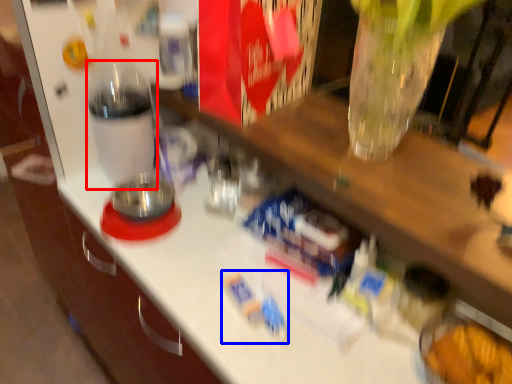
Question: Which object appears closest to the camera in this image, bottle (highlighted by a red box) or toy (highlighted by a blue box)?

Choices:
 (A) bottle
 (B) toy

Answer: (B)